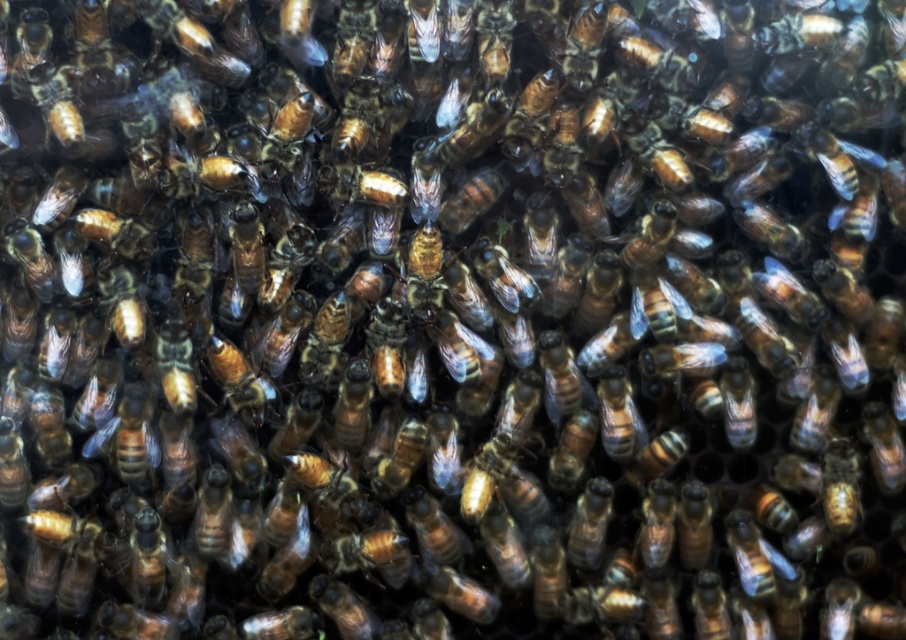
Question: Which object is closer to the camera taking this photo?

Choices:
 (A) brown shiny bee at center
 (B) shiny golden bee at bottom right
 (C) shiny golden bee at center
 (D) shiny brown bee at center

Answer: (B)

Question: Which object appears farthest from the camera in this image?

Choices:
 (A) shiny golden bee at bottom right
 (B) shiny golden bee at center
 (C) brown shiny bee at center

Answer: (C)

Question: Is shiny golden bee at bottom right thinner than brown shiny bee at center?

Choices:
 (A) yes
 (B) no

Answer: (B)

Question: Can you confirm if shiny golden bee at center is positioned to the left of brown shiny bee at center?

Choices:
 (A) yes
 (B) no

Answer: (B)

Question: Which object is farther from the camera taking this photo?

Choices:
 (A) shiny golden bee at center
 (B) brown shiny bee at center
 (C) shiny golden bee at bottom right

Answer: (B)

Question: Is shiny brown bee at center thinner than shiny golden bee at center?

Choices:
 (A) yes
 (B) no

Answer: (B)